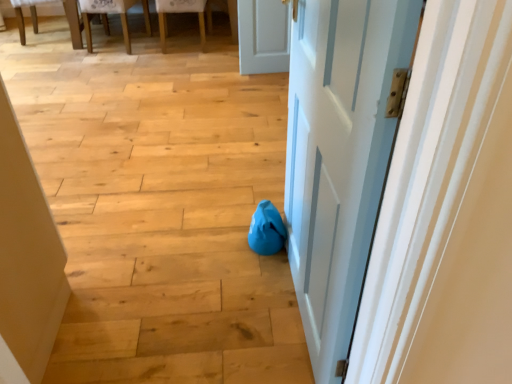
Find the location of a particular element. vacant location below white painted wood door at center (from a real-world perspective) is located at coordinates (295, 306).